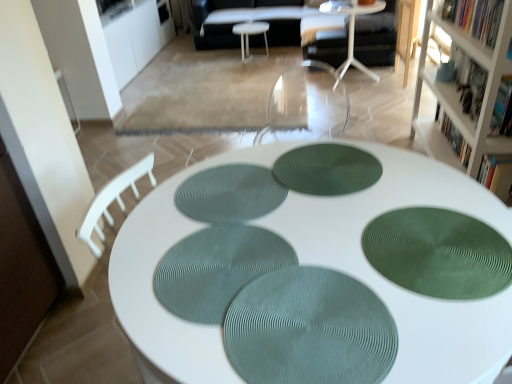
This screenshot has height=384, width=512. In order to click on vacant area to the right of green textured placemat at center, the 4th mat from the right in this screenshot , I will do `click(333, 191)`.